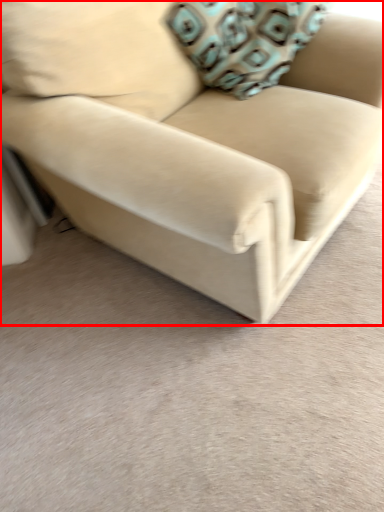
Question: Considering the relative positions of studio couch (annotated by the red box) and throw pillow in the image provided, where is studio couch (annotated by the red box) located with respect to the staircase?

Choices:
 (A) right
 (B) left

Answer: (B)